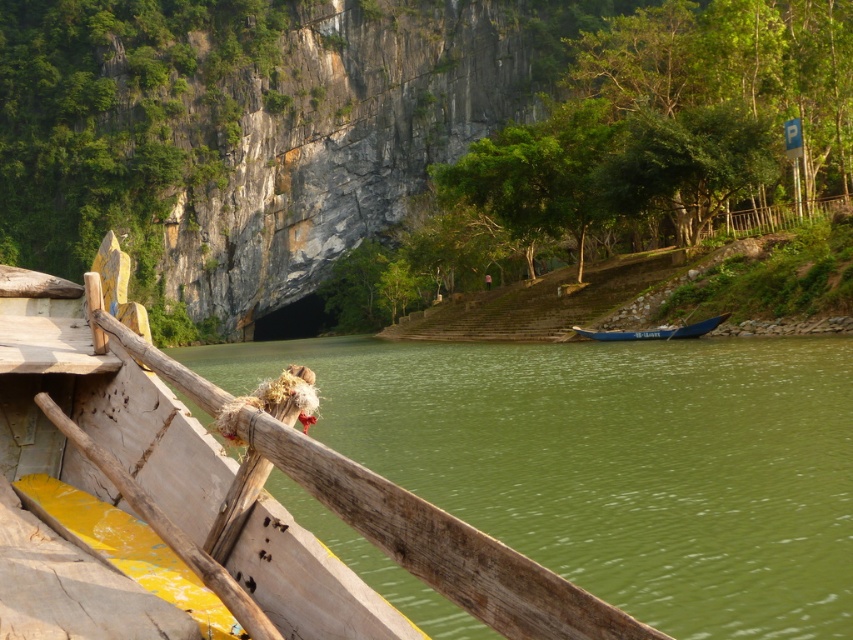
Question: From the image, what is the correct spatial relationship of green smooth water at lower left in relation to blue polished wood boat at center?

Choices:
 (A) below
 (B) above

Answer: (A)

Question: Which of the following is the farthest from the observer?

Choices:
 (A) green smooth water at lower left
 (B) blue polished wood boat at center

Answer: (B)

Question: From the image, what is the correct spatial relationship of green smooth water at lower left in relation to blue polished wood boat at center?

Choices:
 (A) left
 (B) right

Answer: (A)

Question: Which point is farther to the camera?

Choices:
 (A) green smooth water at lower left
 (B) blue polished wood boat at center

Answer: (B)

Question: Can you confirm if green smooth water at lower left is positioned above blue polished wood boat at center?

Choices:
 (A) yes
 (B) no

Answer: (B)